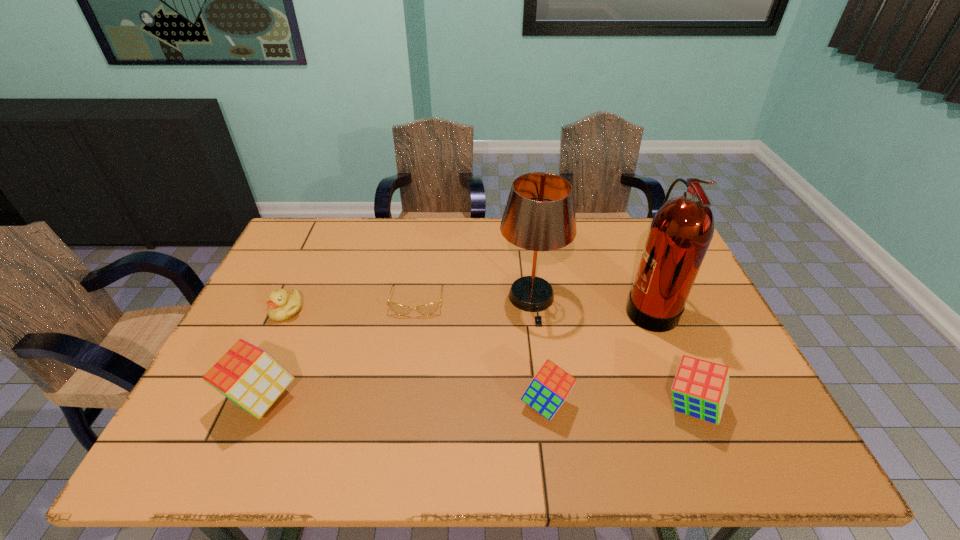
Image resolution: width=960 pixels, height=540 pixels. Identify the location of the leftmost cube. (250, 377).

Locate an element on the screen. The image size is (960, 540). the shortest cube is located at coordinates (549, 388).

Where is `the second cube from left to right`? This screenshot has width=960, height=540. the second cube from left to right is located at coordinates (549, 388).

At what (x,y) coordinates should I click in order to perform the action: click on the fourth shortest object. Please return your answer as a coordinate pair (x, y). The height and width of the screenshot is (540, 960). Looking at the image, I should click on (700, 388).

This screenshot has height=540, width=960. Find the location of `the second shortest cube`. the second shortest cube is located at coordinates (700, 388).

You are a GUI agent. You are given a task and a screenshot of the screen. Output one action in this format:
    pyautogui.click(x=<x>, y=<y>)
    Task: Click on the fire extinguisher
    
    Given the screenshot: What is the action you would take?
    (x=681, y=231)

At what (x,y) coordinates should I click in order to perform the action: click on the fifth object from right to left. Please return your answer as a coordinate pair (x, y). The width and height of the screenshot is (960, 540). Looking at the image, I should click on point(427,309).

This screenshot has height=540, width=960. I want to click on the shortest object, so click(427, 309).

Find the location of `the sixth tallest object`. the sixth tallest object is located at coordinates (282, 305).

Locate an element on the screen. The image size is (960, 540). lampshade is located at coordinates (539, 215).